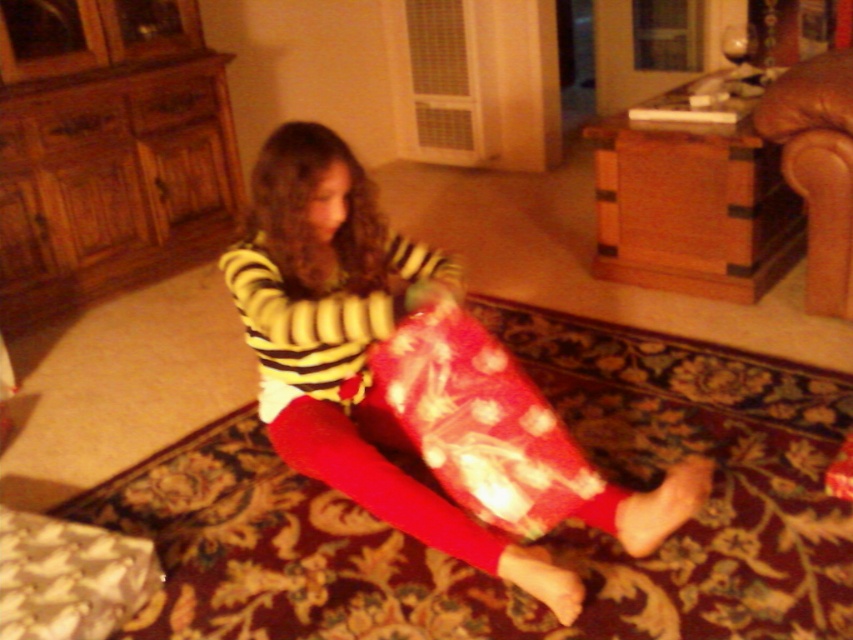
You are a delivery person who just arrived at the house. You need to place a new package on the shiny red wrapping paper at lower center without blocking the view of the brown leather armchair at upper right. Can you do this?

Yes, since the shiny red wrapping paper at lower center is to the left of the brown leather armchair at upper right, placing the package on the wrapping paper would not block the view of the armchair.

You are a photographer setting up a camera at position point 0.5, 0.5. You want to capture the matte red leggings at center in your shot. Based on their 2D location, will the leggings be in the frame if your camera has a standard field of view?

The 2D location of matte red leggings at center is at point (350, 346), which is very close to the camera position at (426, 320). Therefore, the leggings will be within the frame.